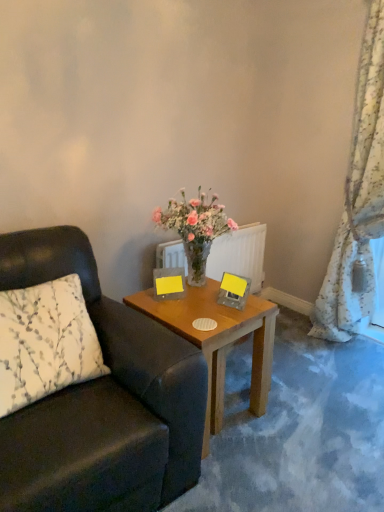
Locate an element on the screen. unoccupied area in front of matte yellow picture frame at upper center, the first picture frame from the left is located at coordinates (169, 310).